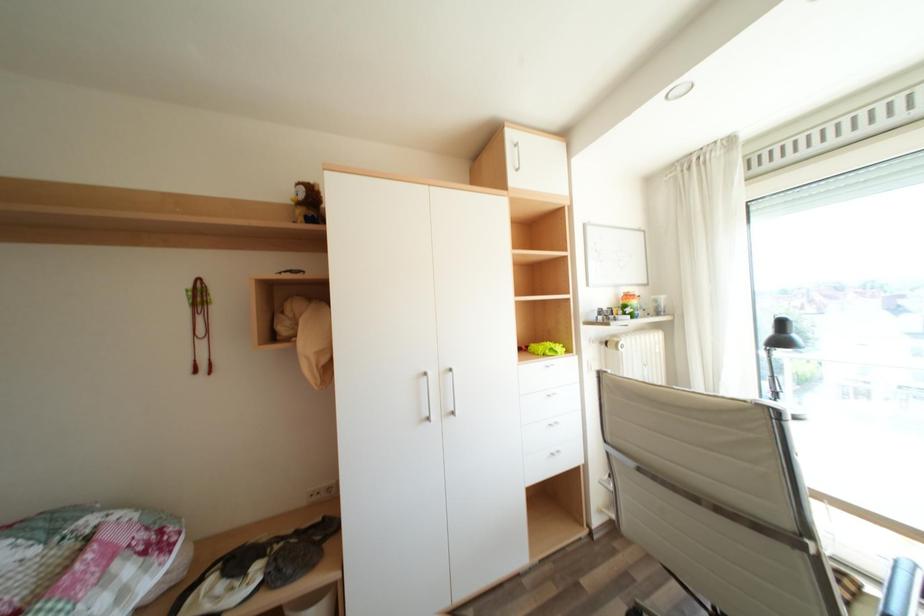
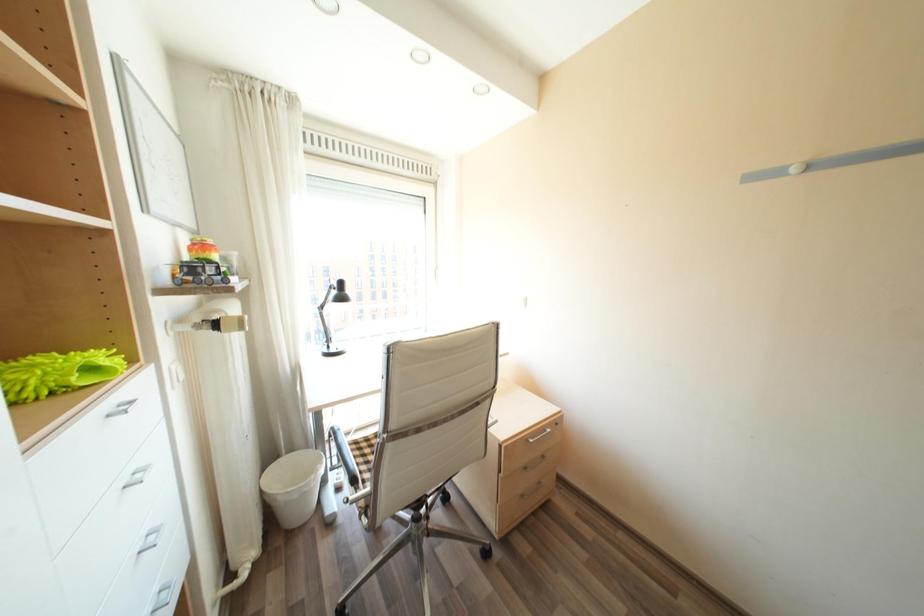
Question: Based on the continuous images, in which direction is the camera rotating? Reply with the corresponding letter.

Choices:
 (A) Left
 (B) Right
 (C) Up
 (D) Down

Answer: (B)